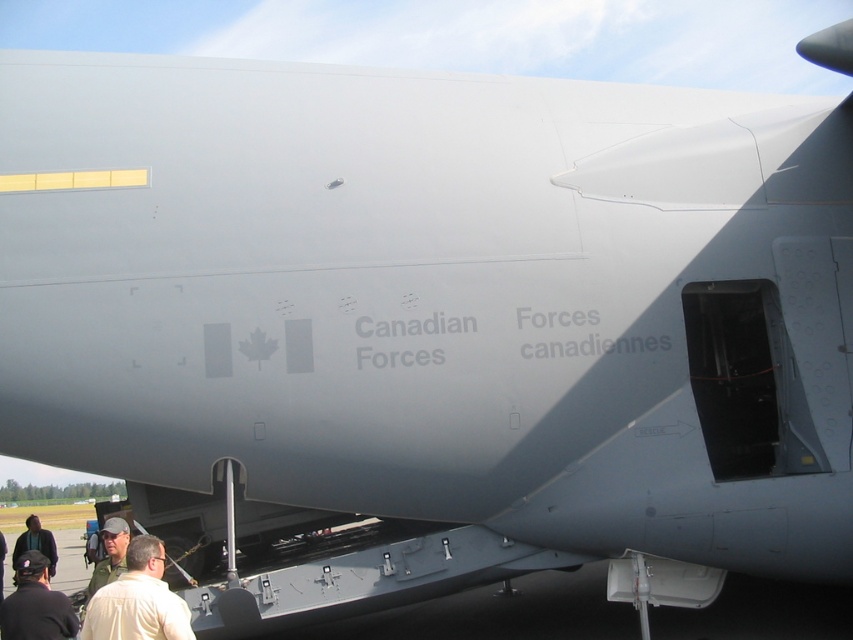
You are standing at the point closest to the aircraft. Which point, point (57, 637) or point (122, 541), is closer to the aircraft?

Point (57, 637) is in front of point (122, 541), so it is closer to the aircraft.

You are a photographer at the event and want to capture a photo of the Canadian Forces aircraft with the two people in the foreground. Since the camouflage fabric cap at lower left and dark gray hair at lower left are both in the frame, which object should you focus on to ensure the wider one is sharp?

The camouflage fabric cap at lower left is wider than the dark gray hair at lower left, so you should focus on the camouflage fabric cap at lower left to ensure the wider object is sharp.

You are standing in front of the Canadian Forces aircraft and notice two points marked on its side. The first point is at coordinate (100, 572) and the second at (3, 556). Which point is physically closer to you?

Point (100, 572) is closer to the viewer than point (3, 556).